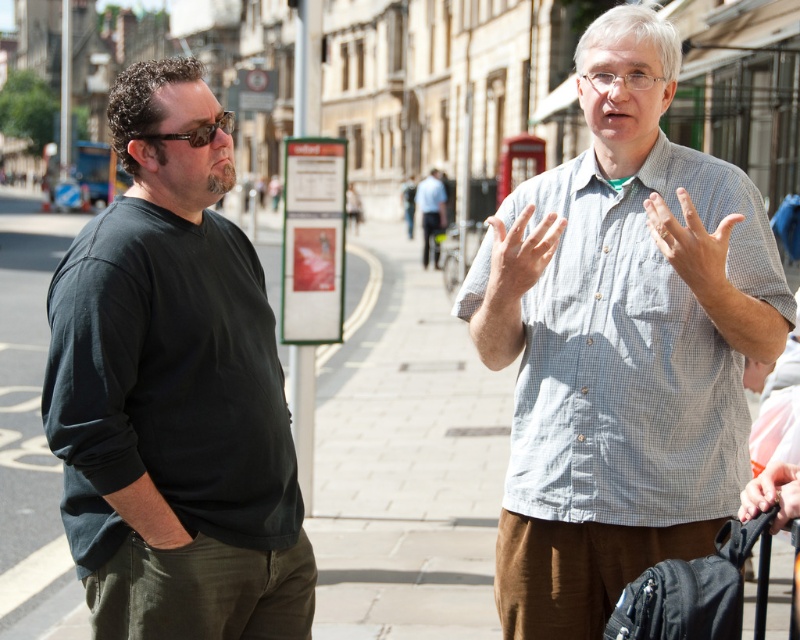
Between point (558, 612) and point (76, 468), which one is positioned in front?

Point (76, 468)

Measure the distance between point [522,616] and camera.

A distance of 16.13 meters exists between point [522,616] and camera.

Identify the location of light blue checkered shirt at center. The height and width of the screenshot is (640, 800). (625, 346).

Can you confirm if light blue checkered shirt at center is positioned to the right of white textured shirt at center?

No, light blue checkered shirt at center is not to the right of white textured shirt at center.

Does light blue checkered shirt at center come behind white textured shirt at center?

Yes, it is.

Identify the location of light blue checkered shirt at center. (625, 346).

Who is taller, paved stone sidewalk at center or white matte hand at center?

Standing taller between the two is paved stone sidewalk at center.

Between paved stone sidewalk at center and white matte hand at center, which one has less height?

white matte hand at center

Image resolution: width=800 pixels, height=640 pixels. What are the coordinates of `paved stone sidewalk at center` in the screenshot? It's located at (408, 465).

Locate an element on the screen. The image size is (800, 640). paved stone sidewalk at center is located at coordinates (408, 465).